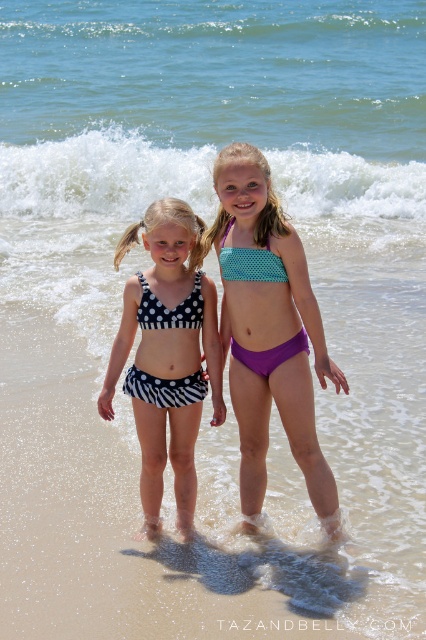
Between white polka dot fabric bikini at center and black polka dot bikini at center, which one is positioned higher?

black polka dot bikini at center is higher up.

Is point (181, 330) farther from camera compared to point (157, 317)?

Yes, it is behind point (157, 317).

Between point (120, 365) and point (199, 387), which one is positioned behind?

Positioned behind is point (199, 387).

Image resolution: width=426 pixels, height=640 pixels. In order to click on white polka dot fabric bikini at center in this screenshot , I will do pos(166,355).

Which is below, teal polka dot bikini top at center or black polka dot bikini at center?

teal polka dot bikini top at center

Is teal polka dot bikini top at center below black polka dot bikini at center?

Yes, teal polka dot bikini top at center is below black polka dot bikini at center.

Which is behind, point (253, 326) or point (195, 296)?

The point (195, 296) is more distant.

The height and width of the screenshot is (640, 426). What are the coordinates of `teal polka dot bikini top at center` in the screenshot? It's located at (270, 332).

Which is above, teal polka dot bikini top at center or white polka dot fabric bikini at center?

teal polka dot bikini top at center is above.

Does teal polka dot bikini top at center have a greater height compared to white polka dot fabric bikini at center?

Yes, teal polka dot bikini top at center is taller than white polka dot fabric bikini at center.

The image size is (426, 640). In order to click on teal polka dot bikini top at center in this screenshot , I will do `click(270, 332)`.